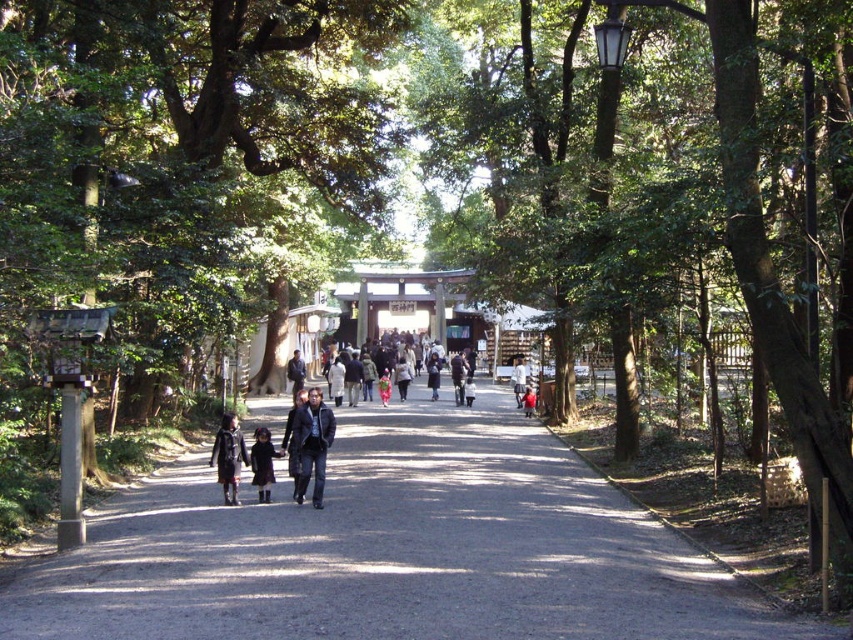
Question: Is dark brown leather coat at center closer to camera compared to dark purple wool coat at center?

Choices:
 (A) yes
 (B) no

Answer: (A)

Question: Based on their relative distances, which object is nearer to the green leafy tree at center?

Choices:
 (A) dirt path at center
 (B) dark blue jacket at center
 (C) dark blue leather jacket at center

Answer: (A)

Question: Estimate the real-world distances between objects in this image. Which object is closer to the light brown leather jacket at center?

Choices:
 (A) dark blue leather jacket at center
 (B) dark purple wool coat at center
 (C) floral fabric dress at center
 (D) green leafy tree at center

Answer: (C)

Question: Which point appears farthest from the camera in this image?

Choices:
 (A) (299, 387)
 (B) (532, 109)

Answer: (A)

Question: Does dirt path at center have a smaller size compared to dark blue leather jacket at center?

Choices:
 (A) no
 (B) yes

Answer: (A)

Question: Does green leafy tree at center have a larger size compared to dark blue leather jacket at center?

Choices:
 (A) yes
 (B) no

Answer: (A)